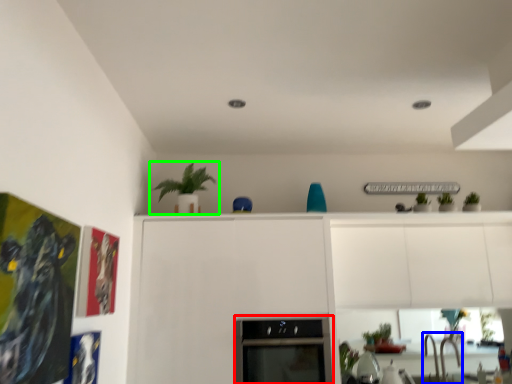
Question: Based on their relative distances, which object is farther from oven (highlighted by a red box)? Choose from sink (highlighted by a blue box) and houseplant (highlighted by a green box).

Choices:
 (A) sink
 (B) houseplant

Answer: (A)